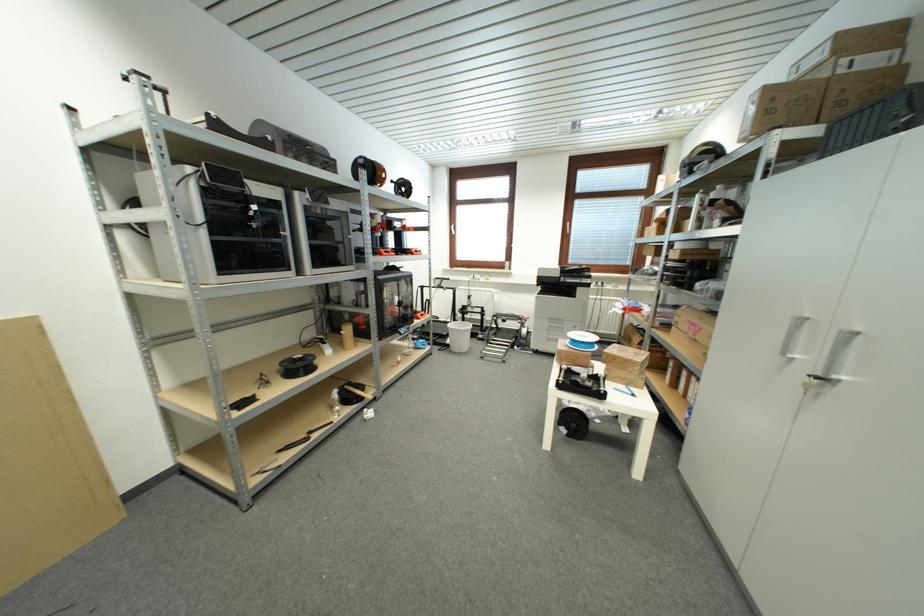
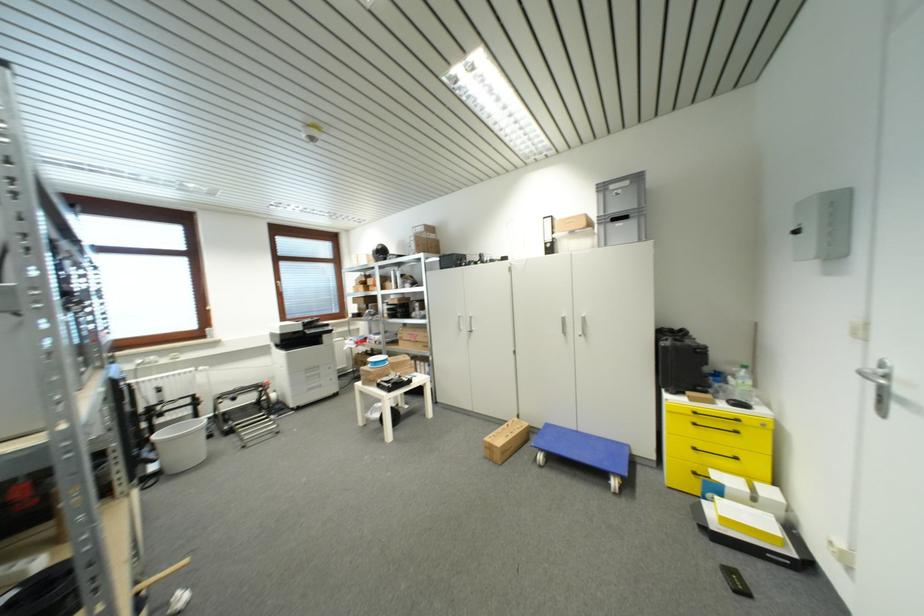
The point at (589, 270) is marked in the first image. Where is the corresponding point in the second image?

(320, 321)